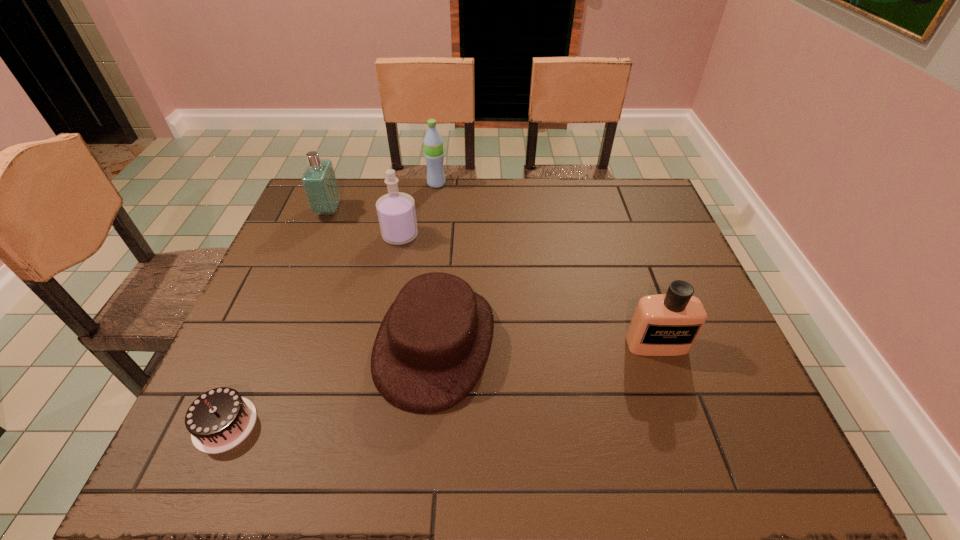
Where is `water bottle`? The width and height of the screenshot is (960, 540). water bottle is located at coordinates (433, 143).

Where is `the second perfume from left to right`? the second perfume from left to right is located at coordinates (396, 212).

Locate an element on the screen. Image resolution: width=960 pixels, height=540 pixels. the fourth nearest object is located at coordinates (396, 212).

The height and width of the screenshot is (540, 960). I want to click on the second farthest object, so click(319, 182).

At what (x,y) coordinates should I click in order to perform the action: click on the farthest perfume. Please return your answer as a coordinate pair (x, y). This screenshot has height=540, width=960. Looking at the image, I should click on (319, 182).

What are the coordinates of `the rightmost perfume` in the screenshot? It's located at (668, 324).

Identify the location of the rightmost object. (668, 324).

Locate an element on the screen. Image resolution: width=960 pixels, height=540 pixels. the second shortest object is located at coordinates (433, 343).

Where is `the shortest object`? This screenshot has height=540, width=960. the shortest object is located at coordinates pos(218,420).

Find the location of a particular element. This screenshot has width=960, height=540. vacant space situated 0.360m on the right of the farthest object is located at coordinates (554, 184).